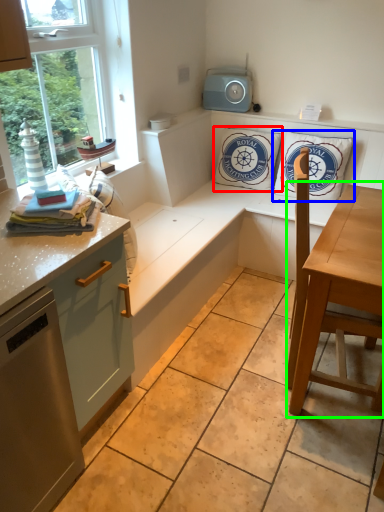
Question: Which object is positioned closest to pillow (highlighted by a red box)? Select from pillow (highlighted by a blue box) and table (highlighted by a green box).

Choices:
 (A) pillow
 (B) table

Answer: (A)